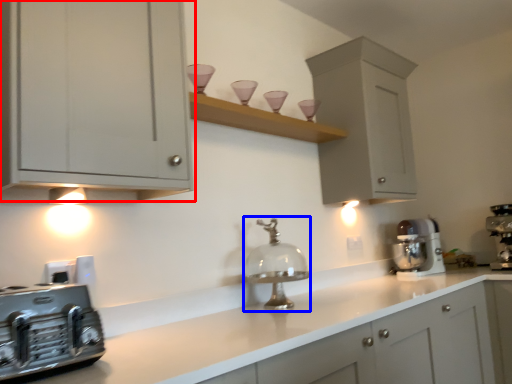
Question: Among these objects, which one is nearest to the camera, cabinetry (highlighted by a red box) or faucet (highlighted by a blue box)?

Choices:
 (A) cabinetry
 (B) faucet

Answer: (A)